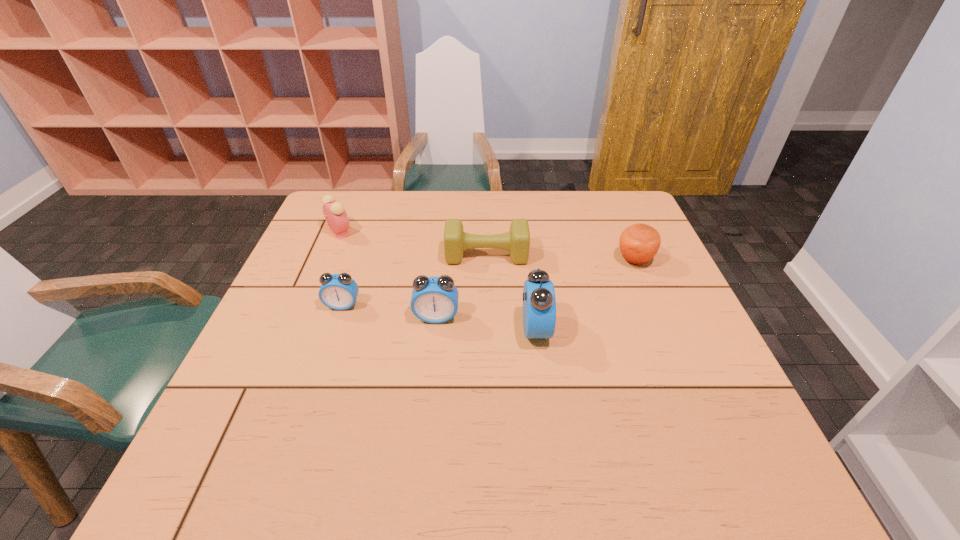
Locate an element on the screen. The image size is (960, 540). vacant region between the tallest object and the rightmost object is located at coordinates (586, 294).

At what (x,y) coordinates should I click in order to perform the action: click on vacant area that lies between the farthest object and the dumbbell. Please return your answer as a coordinate pair (x, y). Looking at the image, I should click on (413, 244).

The image size is (960, 540). Identify the location of free area in between the farthest alarm clock and the second alarm clock from right to left. (388, 274).

What are the coordinates of `unoccupied position between the rightmost alarm clock and the orange` in the screenshot? It's located at (586, 294).

Select which object is the closest to the farthest alarm clock. Please provide its 2D coordinates. Your answer should be formatted as a tuple, i.e. [(x, y)], where the tuple contains the x and y coordinates of a point satisfying the conditions above.

[(338, 291)]

Identify the location of object identified as the fourth closest to the dumbbell. (639, 243).

Locate an element on the screen. Image resolution: width=960 pixels, height=540 pixels. alarm clock that is the third closest one to the farthest object is located at coordinates (539, 302).

Locate an element on the screen. alarm clock identified as the closest to the orange is located at coordinates (539, 302).

Locate an element on the screen. The height and width of the screenshot is (540, 960). vacant point that satisfies the following two spatial constraints: 1. on the face of the farthest alarm clock; 2. on the right side of the orange is located at coordinates (328, 260).

You are a GUI agent. You are given a task and a screenshot of the screen. Output one action in this format:
    pyautogui.click(x=<x>, y=<y>)
    Task: Click on the vacant space that satisfies the following two spatial constraints: 1. on the face of the orange; 2. on the right side of the farthest alarm clock
    
    Given the screenshot: What is the action you would take?
    pyautogui.click(x=328, y=260)